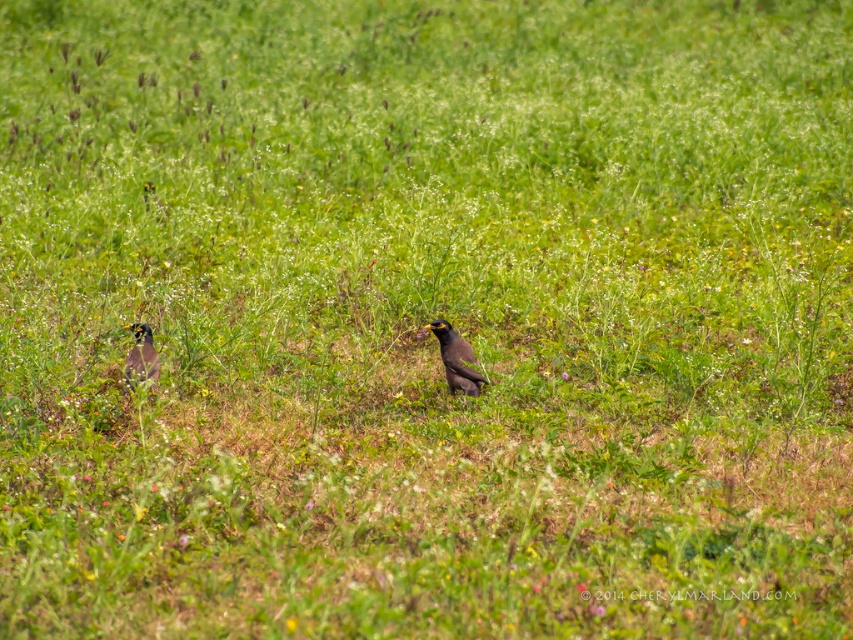
Question: Does brown speckled bird at center have a larger size compared to shiny black bird at left?

Choices:
 (A) yes
 (B) no

Answer: (A)

Question: Which point is closer to the camera?

Choices:
 (A) brown speckled bird at center
 (B) shiny black bird at left

Answer: (B)

Question: Which of the following is the closest to the observer?

Choices:
 (A) shiny black bird at left
 (B) brown speckled bird at center

Answer: (A)

Question: Is brown speckled bird at center behind shiny black bird at left?

Choices:
 (A) yes
 (B) no

Answer: (A)

Question: Can you confirm if brown speckled bird at center is bigger than shiny black bird at left?

Choices:
 (A) yes
 (B) no

Answer: (A)